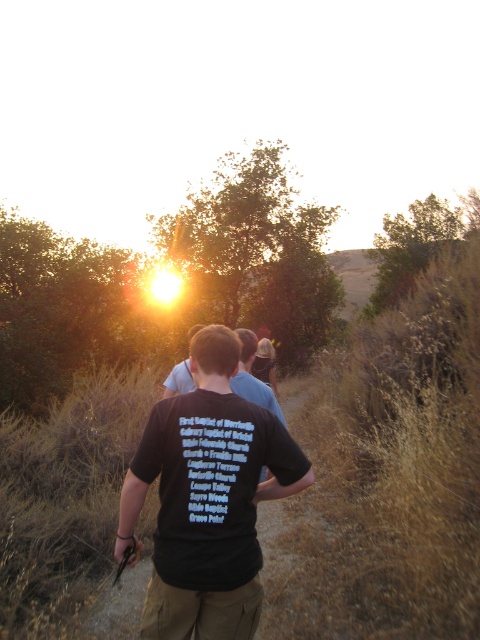
Is black t-shirt at center below dark blue t-shirt at center?

Indeed, black t-shirt at center is positioned under dark blue t-shirt at center.

Find the location of a particular element. black t-shirt at center is located at coordinates [x=206, y=499].

Between dark blue t-shirt at center and matte blue shirt at center, which one appears on the left side from the viewer's perspective?

matte blue shirt at center is more to the left.

Who is more distant from viewer, [244,378] or [180,369]?

The point [180,369] is behind.

This screenshot has width=480, height=640. Identify the location of dark blue t-shirt at center. (252, 376).

Looking at this image, is black t-shirt at center to the left of matte blue shirt at center from the viewer's perspective?

No, black t-shirt at center is not to the left of matte blue shirt at center.

Image resolution: width=480 pixels, height=640 pixels. What do you see at coordinates (206, 499) in the screenshot? I see `black t-shirt at center` at bounding box center [206, 499].

Image resolution: width=480 pixels, height=640 pixels. What are the coordinates of `black t-shirt at center` in the screenshot? It's located at (206, 499).